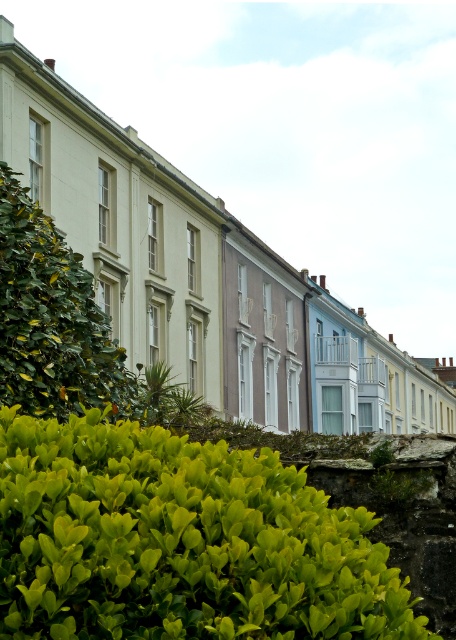
Question: Is green leafy hedge at lower left below green leafy hedge at left?

Choices:
 (A) no
 (B) yes

Answer: (B)

Question: Among these objects, which one is farthest from the camera?

Choices:
 (A) green leafy hedge at lower left
 (B) green leafy hedge at left

Answer: (B)

Question: Is green leafy hedge at lower left to the left of green leafy hedge at left from the viewer's perspective?

Choices:
 (A) no
 (B) yes

Answer: (A)

Question: In this image, where is green leafy hedge at lower left located relative to green leafy hedge at left?

Choices:
 (A) right
 (B) left

Answer: (A)

Question: Which of the following is the farthest from the observer?

Choices:
 (A) (67, 358)
 (B) (315, 493)

Answer: (A)